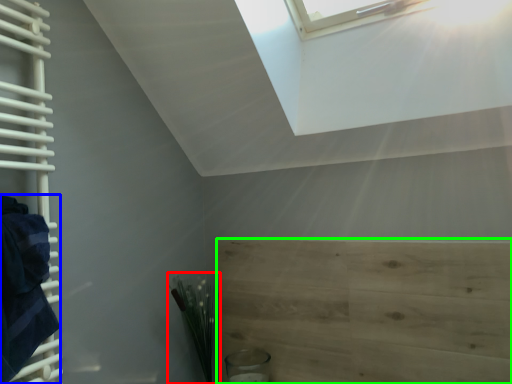
Question: Which object is positioned farthest from plant (highlighted by a red box)? Select from blanket (highlighted by a blue box) and plywood (highlighted by a green box).

Choices:
 (A) blanket
 (B) plywood

Answer: (A)